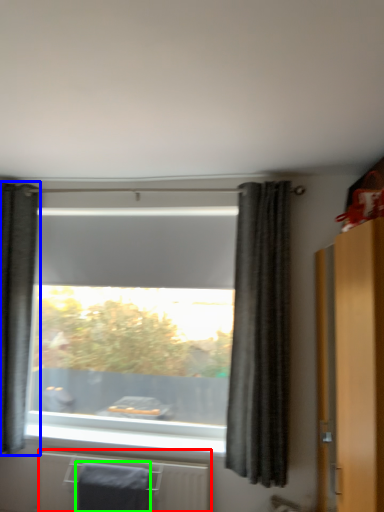
Question: Which object is positioned farthest from radiator (highlighted by a red box)? Select from curtain (highlighted by a blue box) and bath towel (highlighted by a green box).

Choices:
 (A) curtain
 (B) bath towel

Answer: (A)